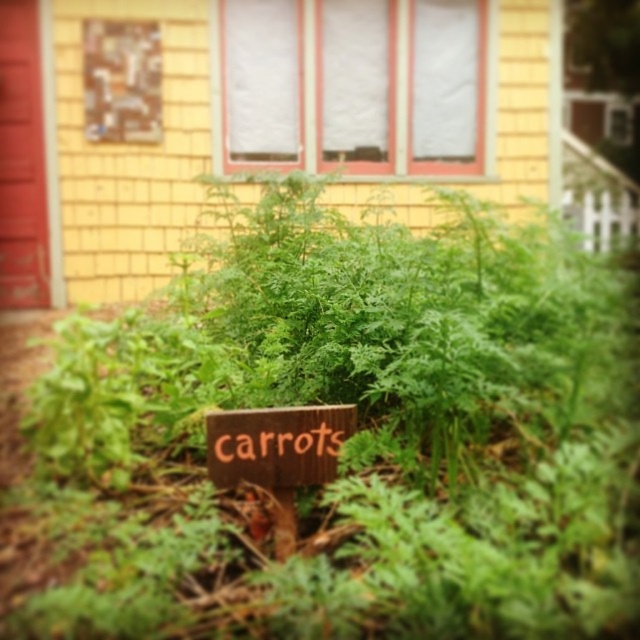
Question: Which point is closer to the camera taking this photo?

Choices:
 (A) [129, 340]
 (B) [269, 454]

Answer: (B)

Question: Which of the following is the farthest from the observer?

Choices:
 (A) green leafy plant at center
 (B) wooden sign at center

Answer: (B)

Question: In this image, where is green leafy plant at center located relative to wooden sign at center?

Choices:
 (A) left
 (B) right

Answer: (B)

Question: Can you confirm if green leafy plant at center is wider than wooden sign at center?

Choices:
 (A) no
 (B) yes

Answer: (B)

Question: Is green leafy plant at center to the left of wooden sign at center from the viewer's perspective?

Choices:
 (A) yes
 (B) no

Answer: (B)